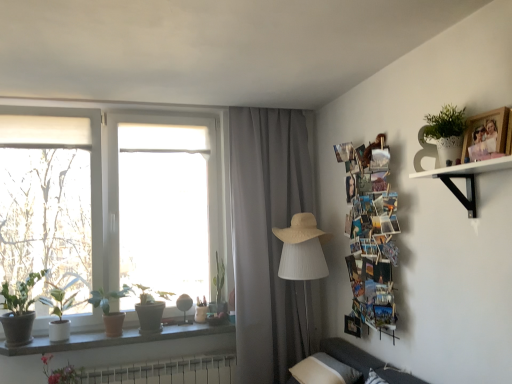
Question: Does gray fabric curtain at center have a greater height compared to granite window sill at lower left?

Choices:
 (A) yes
 (B) no

Answer: (A)

Question: Is gray fabric curtain at center behind granite window sill at lower left?

Choices:
 (A) no
 (B) yes

Answer: (B)

Question: Considering the relative sizes of gray fabric curtain at center and granite window sill at lower left in the image provided, is gray fabric curtain at center bigger than granite window sill at lower left?

Choices:
 (A) yes
 (B) no

Answer: (A)

Question: Is gray fabric curtain at center positioned far away from granite window sill at lower left?

Choices:
 (A) yes
 (B) no

Answer: (B)

Question: Is gray fabric curtain at center completely or partially outside of granite window sill at lower left?

Choices:
 (A) yes
 (B) no

Answer: (A)

Question: Which is correct: granite window sill at lower left is inside green matte plant at left, positioned as the 2th houseplant in left-to-right order, or outside of it?

Choices:
 (A) inside
 (B) outside

Answer: (B)

Question: From a real-world perspective, is granite window sill at lower left positioned above or below green matte plant at left, marked as the fourth houseplant in a right-to-left arrangement?

Choices:
 (A) above
 (B) below

Answer: (B)

Question: In the image, is granite window sill at lower left positioned in front of or behind green matte plant at left, marked as the fourth houseplant in a right-to-left arrangement?

Choices:
 (A) front
 (B) behind

Answer: (B)

Question: In terms of size, does granite window sill at lower left appear bigger or smaller than green matte plant at left, marked as the fourth houseplant in a right-to-left arrangement?

Choices:
 (A) small
 (B) big

Answer: (A)

Question: From a real-world perspective, is beige straw hat at center above or below wooden photo frame at upper right?

Choices:
 (A) above
 (B) below

Answer: (B)

Question: Is beige straw hat at center to the left or to the right of wooden photo frame at upper right in the image?

Choices:
 (A) right
 (B) left

Answer: (B)

Question: Is beige straw hat at center bigger or smaller than wooden photo frame at upper right?

Choices:
 (A) big
 (B) small

Answer: (A)

Question: From the image's perspective, is beige straw hat at center located above or below wooden photo frame at upper right?

Choices:
 (A) above
 (B) below

Answer: (B)

Question: Considering their positions, is white matte shelf at upper right located in front of or behind pink matte flower at lower left?

Choices:
 (A) front
 (B) behind

Answer: (A)

Question: Do you think white matte shelf at upper right is within pink matte flower at lower left, or outside of it?

Choices:
 (A) outside
 (B) inside

Answer: (A)